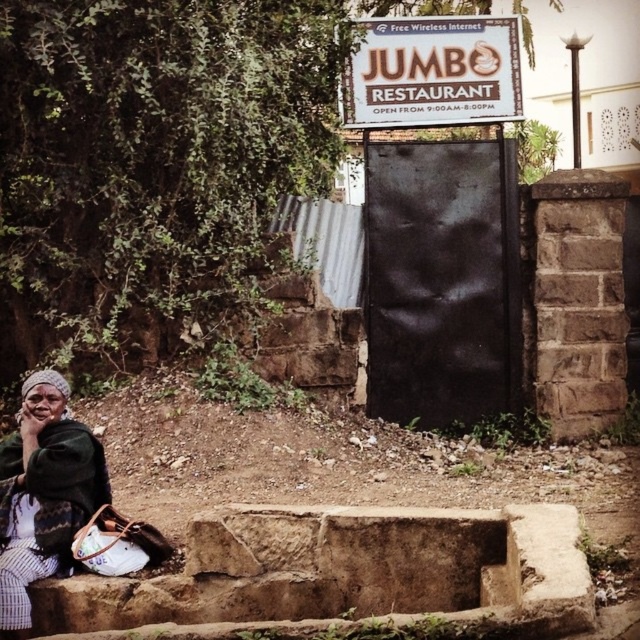
Question: Considering the real-world distances, which object is farthest from the white plastic sign at upper center?

Choices:
 (A) brown stone ledge at lower center
 (B) green woven fabric at lower left

Answer: (B)

Question: Which point is farther to the camera?

Choices:
 (A) (561, 616)
 (B) (35, 404)
 (C) (420, 35)

Answer: (C)

Question: Can you confirm if brown stone ledge at lower center is positioned above white plastic sign at upper center?

Choices:
 (A) yes
 (B) no

Answer: (B)

Question: Can you confirm if brown stone ledge at lower center is bigger than green woven fabric at lower left?

Choices:
 (A) no
 (B) yes

Answer: (B)

Question: Estimate the real-world distances between objects in this image. Which object is closer to the green woven fabric at lower left?

Choices:
 (A) white plastic sign at upper center
 (B) brown stone ledge at lower center

Answer: (B)

Question: Considering the relative positions of white plastic sign at upper center and green woven fabric at lower left in the image provided, where is white plastic sign at upper center located with respect to green woven fabric at lower left?

Choices:
 (A) above
 (B) below

Answer: (A)